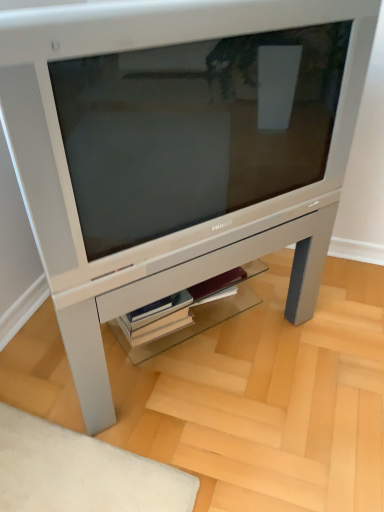
Question: Do you think satin silver monitor at center is within white glossy shelf at center, or outside of it?

Choices:
 (A) outside
 (B) inside

Answer: (A)

Question: From a real-world perspective, is satin silver monitor at center physically located above or below white glossy shelf at center?

Choices:
 (A) above
 (B) below

Answer: (A)

Question: Estimate the real-world distances between objects in this image. Which object is farther from the satin silver table at center?

Choices:
 (A) white glossy shelf at center
 (B) satin silver monitor at center

Answer: (B)

Question: Based on their relative distances, which object is nearer to the satin silver monitor at center?

Choices:
 (A) white glossy shelf at center
 (B) satin silver table at center

Answer: (B)